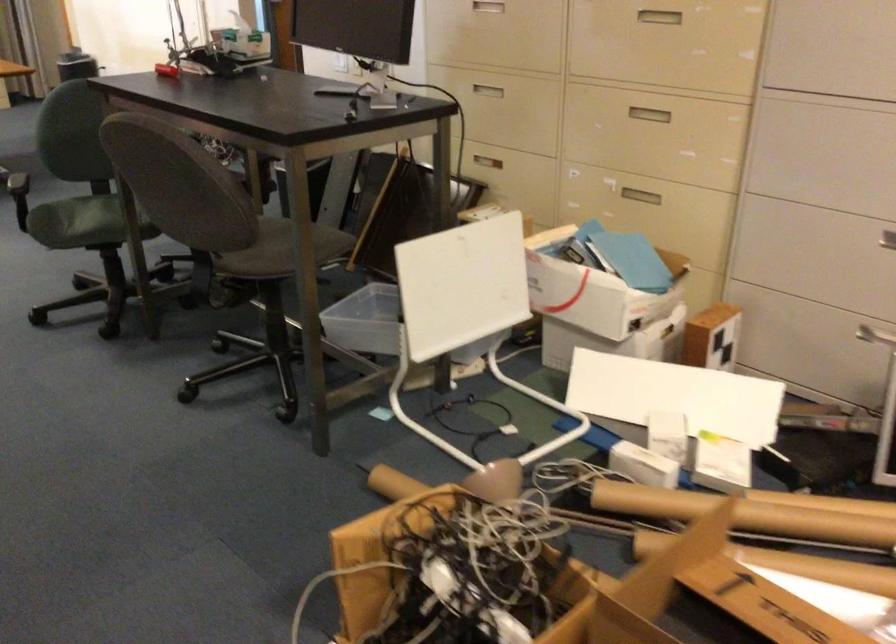
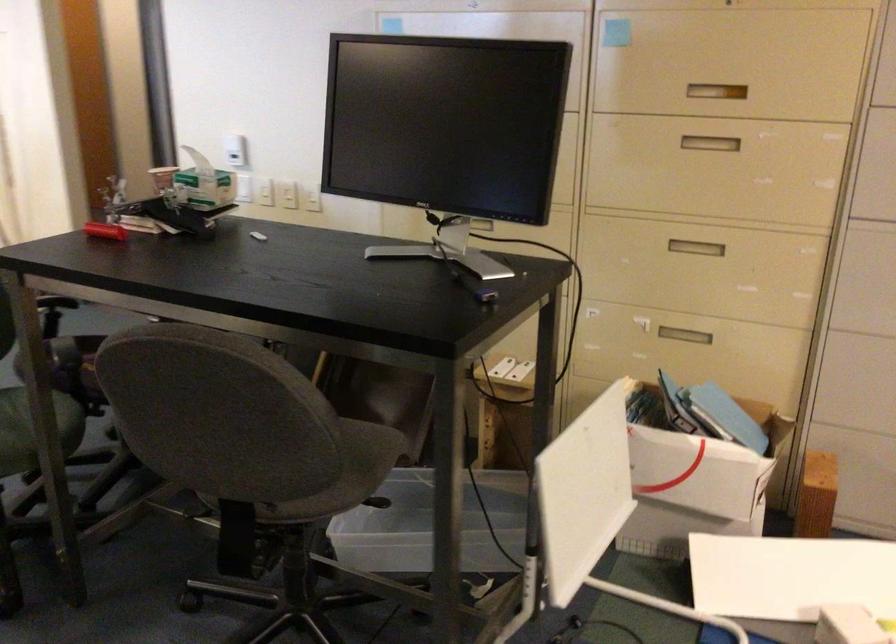
What movement of the cameraman would produce the second image?

The movement direction of the cameraman is left, forward.